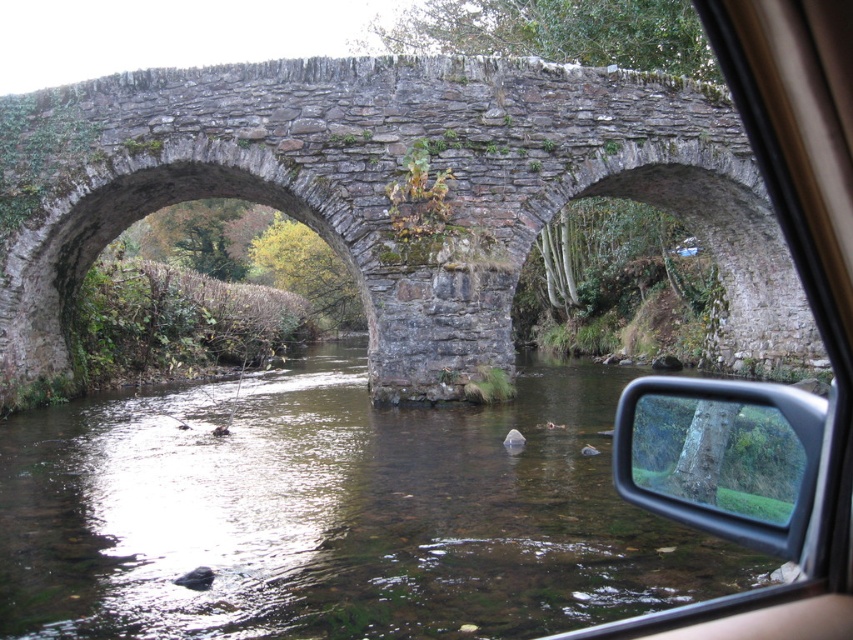
Is clear water at center behind rustic stone bridge at center?

That is False.

Between point (119, 476) and point (650, 186), which one is positioned behind?

Point (650, 186)

Is point (213, 611) behind point (764, 273)?

No, (213, 611) is closer to viewer.

Where is `clear water at center`? The height and width of the screenshot is (640, 853). clear water at center is located at coordinates (335, 513).

Can you confirm if clear water at center is thinner than transparent glass mirror at center?

In fact, clear water at center might be wider than transparent glass mirror at center.

Is clear water at center bigger than transparent glass mirror at center?

Incorrect, clear water at center is not larger than transparent glass mirror at center.

Is point (62, 584) more distant than point (715, 502)?

Yes, it is.

Identify the location of clear water at center. This screenshot has width=853, height=640. (335, 513).

From the picture: Who is positioned more to the left, rustic stone bridge at center or transparent glass mirror at center?

Positioned to the left is rustic stone bridge at center.

Does rustic stone bridge at center have a larger size compared to transparent glass mirror at center?

Indeed, rustic stone bridge at center has a larger size compared to transparent glass mirror at center.

Locate an element on the screen. Image resolution: width=853 pixels, height=640 pixels. rustic stone bridge at center is located at coordinates (386, 192).